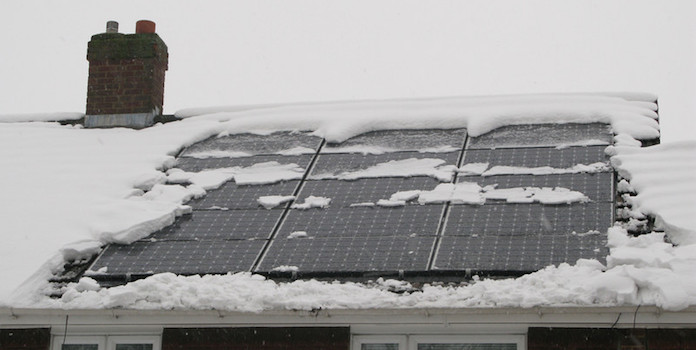
The image size is (696, 350). I want to click on 2 top of windows on the left, so click(x=140, y=346), click(x=86, y=336).